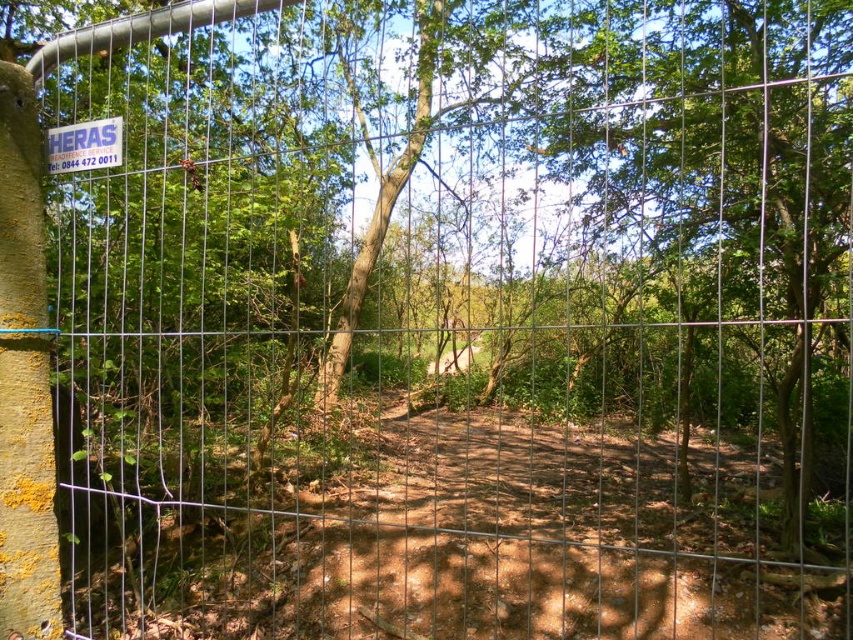
Who is more distant from viewer, (312, 525) or (45, 147)?

The point (312, 525) is more distant.

Measure the distance between brown dirt track at center and white plastic sign at upper left.

4.90 meters

Between point (543, 465) and point (91, 124), which one is positioned behind?

Point (543, 465)

You are a GUI agent. You are given a task and a screenshot of the screen. Output one action in this format:
    pyautogui.click(x=<x>, y=<y>)
    Task: Click on the brown dirt track at center
    
    Given the screenshot: What is the action you would take?
    pyautogui.click(x=457, y=529)